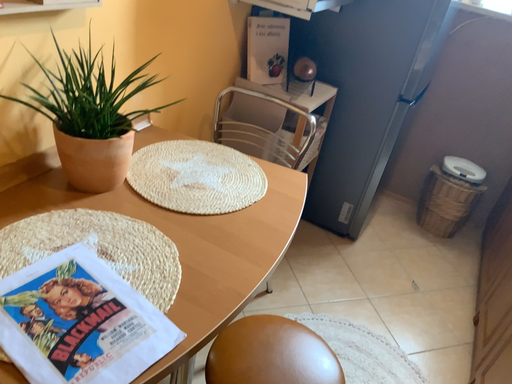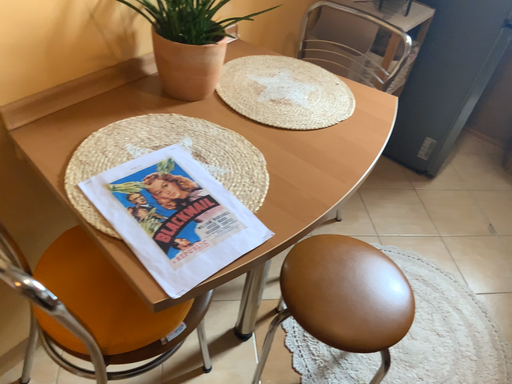
Question: How did the camera likely rotate when shooting the video?

Choices:
 (A) rotated downward
 (B) rotated upward

Answer: (A)